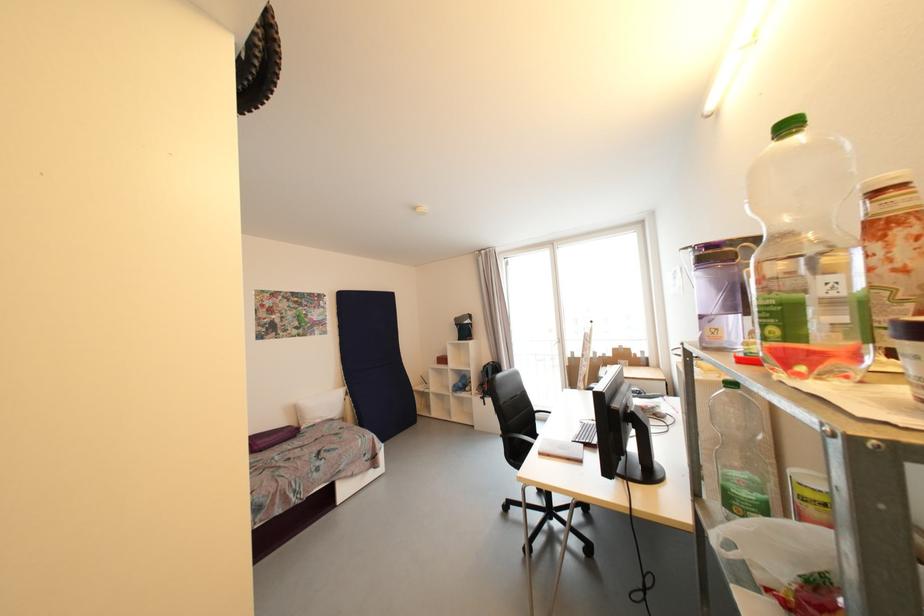
At what (x,y) coordinates should I click in order to perform the action: click on black chair armrest. Please return your answer as a coordinate pair (x, y). This screenshot has height=616, width=924. Looking at the image, I should click on (521, 436).